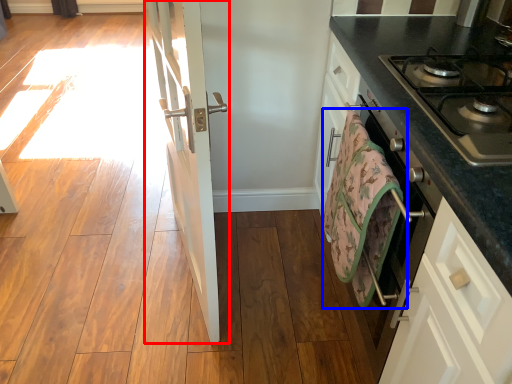
Question: Among these objects, which one is farthest to the camera, door (highlighted by a red box) or beach towel (highlighted by a blue box)?

Choices:
 (A) door
 (B) beach towel

Answer: (B)